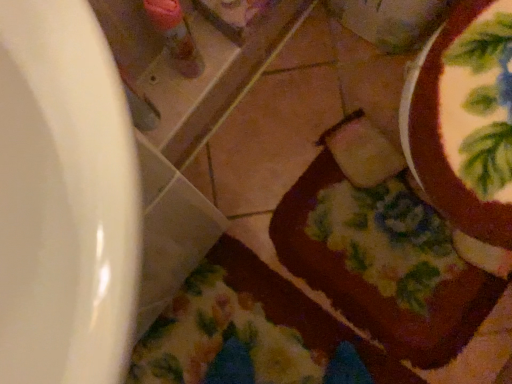
Question: Can you confirm if chocolate frosted cake at lower right is positioned to the left of floral fabric blanket at lower center?

Choices:
 (A) yes
 (B) no

Answer: (B)

Question: From the image's perspective, is chocolate frosted cake at lower right beneath floral fabric blanket at lower center?

Choices:
 (A) yes
 (B) no

Answer: (B)

Question: Is chocolate frosted cake at lower right bigger than floral fabric blanket at lower center?

Choices:
 (A) no
 (B) yes

Answer: (B)

Question: From a real-world perspective, is chocolate frosted cake at lower right located beneath floral fabric blanket at lower center?

Choices:
 (A) no
 (B) yes

Answer: (A)

Question: Does chocolate frosted cake at lower right have a greater height compared to floral fabric blanket at lower center?

Choices:
 (A) no
 (B) yes

Answer: (B)

Question: From a real-world perspective, does chocolate frosted cake at lower right stand above floral fabric blanket at lower center?

Choices:
 (A) yes
 (B) no

Answer: (A)

Question: Is floral fabric blanket at lower center touching chocolate frosted cake at lower right?

Choices:
 (A) no
 (B) yes

Answer: (A)

Question: Is floral fabric blanket at lower center not near chocolate frosted cake at lower right?

Choices:
 (A) no
 (B) yes

Answer: (A)

Question: Can you confirm if floral fabric blanket at lower center is wider than chocolate frosted cake at lower right?

Choices:
 (A) no
 (B) yes

Answer: (A)

Question: From the image's perspective, does floral fabric blanket at lower center appear lower than chocolate frosted cake at lower right?

Choices:
 (A) no
 (B) yes

Answer: (B)

Question: Can you confirm if floral fabric blanket at lower center is positioned to the right of chocolate frosted cake at lower right?

Choices:
 (A) no
 (B) yes

Answer: (A)

Question: Is floral fabric blanket at lower center positioned before chocolate frosted cake at lower right?

Choices:
 (A) yes
 (B) no

Answer: (A)

Question: From a real-world perspective, is chocolate frosted cake at lower right above or below floral fabric blanket at lower center?

Choices:
 (A) above
 (B) below

Answer: (A)